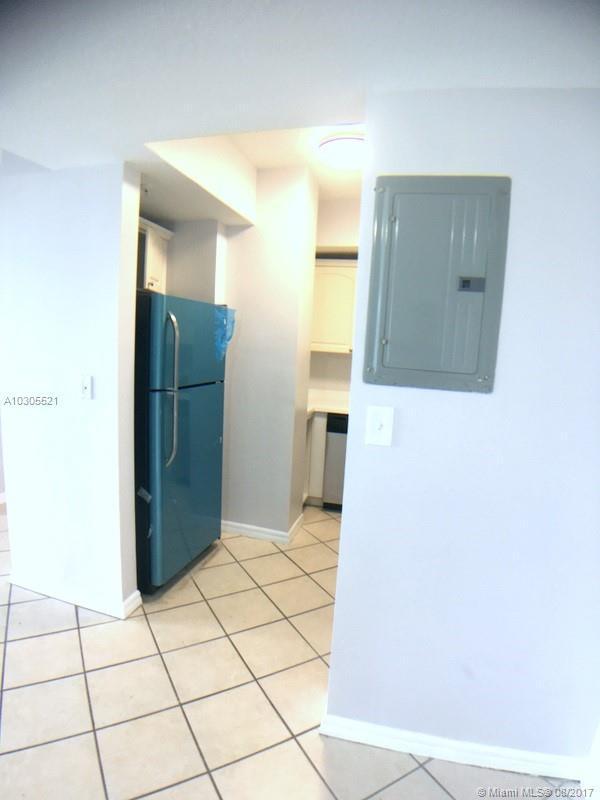
The width and height of the screenshot is (600, 800). I want to click on fridge handle, so click(176, 440), click(175, 365).